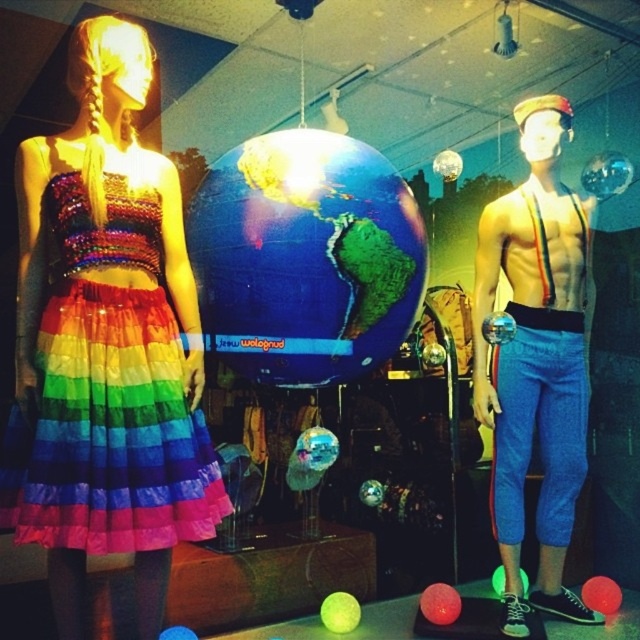
You are a store employee who needs to rearrange the display. The rainbow tulle skirt at left and the glossy plastic globe at center are both in your way. Which object should you move first to free up more space?

The rainbow tulle skirt at left occupies less space than the glossy plastic globe at center, so you should move the glossy plastic globe at center first to free up more space.

You are a window dresser arranging items in a store display. You have the glossy plastic globe at center and the shiny blue pants at right. Which object should you place closer to the entrance to make the larger item more prominent?

You should place the shiny blue pants at right closer to the entrance because it is larger than the glossy plastic globe at center, making it more prominent when positioned near the entrance.

You are a customer in a store and see the rainbow tulle skirt at left and the glossy plastic globe at center. Which object is positioned to the left of the other?

The rainbow tulle skirt at left is to the left of the glossy plastic globe at center.